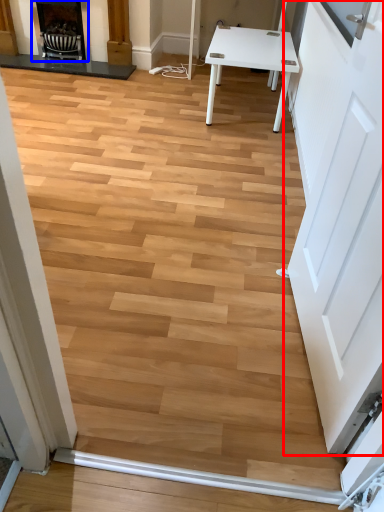
Question: Among these objects, which one is nearest to the camera, door (highlighted by a red box) or fireplace (highlighted by a blue box)?

Choices:
 (A) door
 (B) fireplace

Answer: (A)